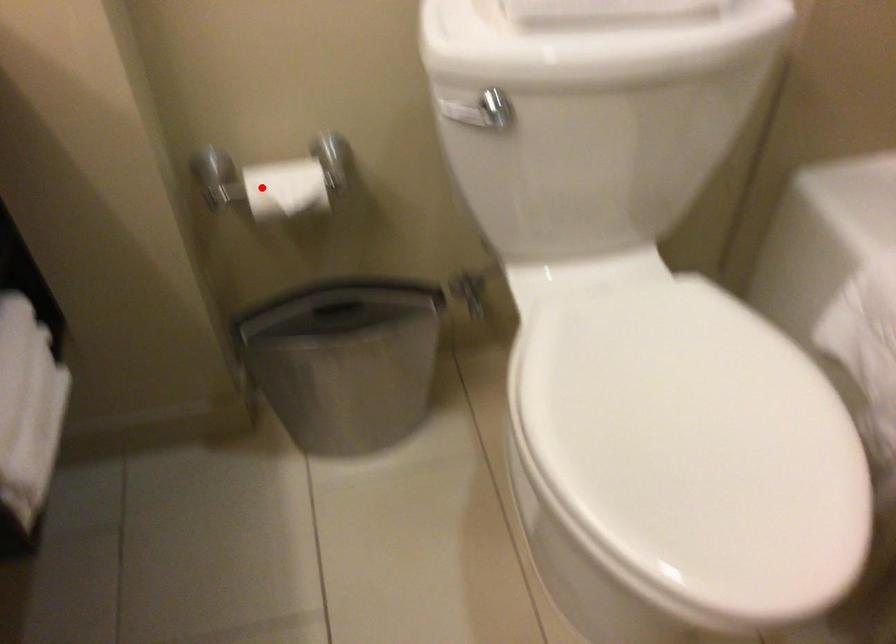
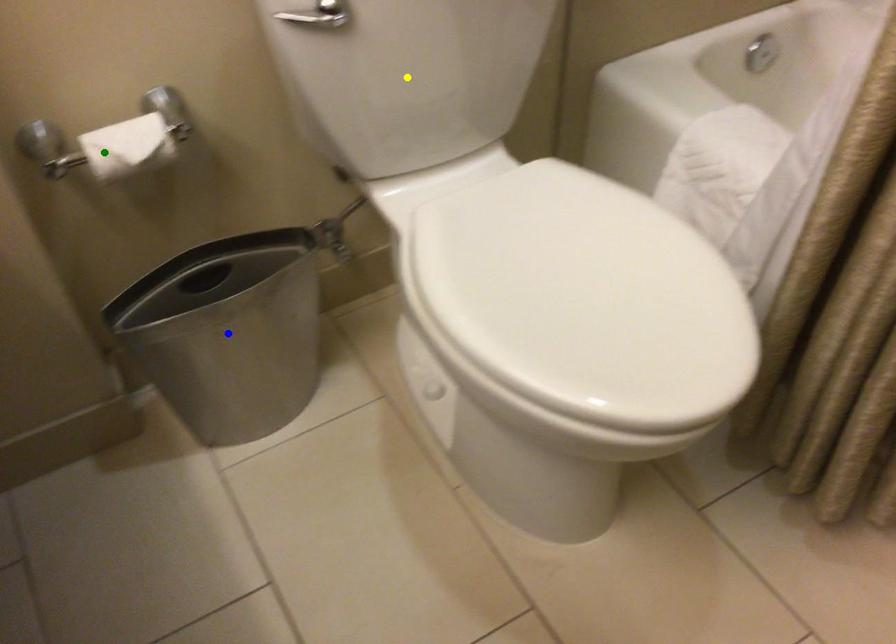
Question: I am providing you with two images of the same scene from different viewpoints. A red point is marked on the first image. You are given multiple points on the second image. Which spot in image 2 lines up with the point in image 1?

Choices:
 (A) yellow point
 (B) green point
 (C) blue point

Answer: (B)